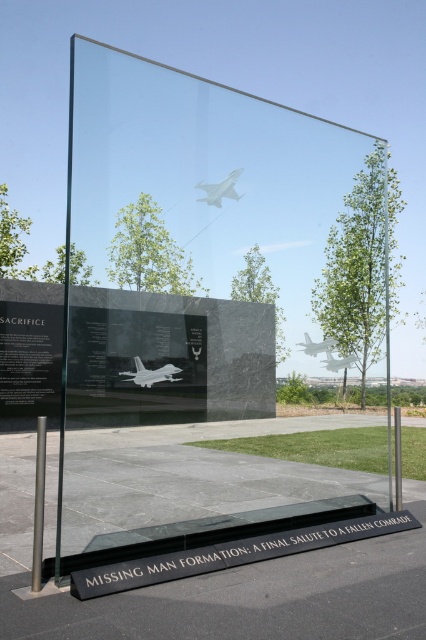
Question: Observing the image, what is the correct spatial positioning of black polished stone plaque at lower center in reference to metallic silver jet at center?

Choices:
 (A) right
 (B) left

Answer: (B)

Question: Is black polished stone plaque at lower center smaller than white matte airplane at center?

Choices:
 (A) no
 (B) yes

Answer: (B)

Question: Is transparent glass box at center to the left of white glossy airplane at center from the viewer's perspective?

Choices:
 (A) no
 (B) yes

Answer: (B)

Question: Among these objects, which one is farthest from the camera?

Choices:
 (A) black polished stone plaque at lower center
 (B) metallic silver jet at center
 (C) transparent glass box at center
 (D) matte white airplane at center

Answer: (B)

Question: Which of the following is the farthest from the observer?

Choices:
 (A) black polished stone plaque at lower center
 (B) white glossy airplane at center

Answer: (B)

Question: Which of the following is the closest to the observer?

Choices:
 (A) matte white airplane at center
 (B) transparent glass box at center
 (C) metallic silver jet at center

Answer: (B)